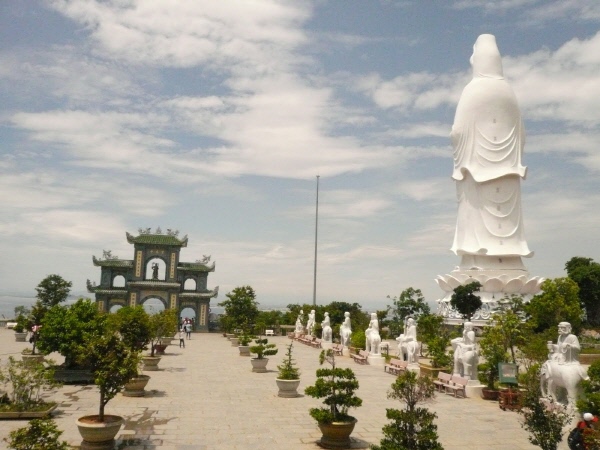
You are a GUI agent. You are given a task and a screenshot of the screen. Output one action in this format:
    pyautogui.click(x=<x>, y=<y>)
    Task: Click on the bench
    
    Given the screenshot: What is the action you would take?
    pyautogui.click(x=451, y=387), pyautogui.click(x=442, y=377), pyautogui.click(x=397, y=366), pyautogui.click(x=360, y=358), pyautogui.click(x=336, y=348), pyautogui.click(x=316, y=345), pyautogui.click(x=304, y=338)